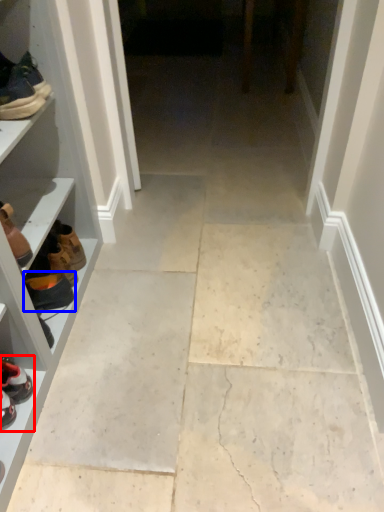
Question: Which object is closer to the camera taking this photo, footwear (highlighted by a red box) or footwear (highlighted by a blue box)?

Choices:
 (A) footwear
 (B) footwear

Answer: (A)